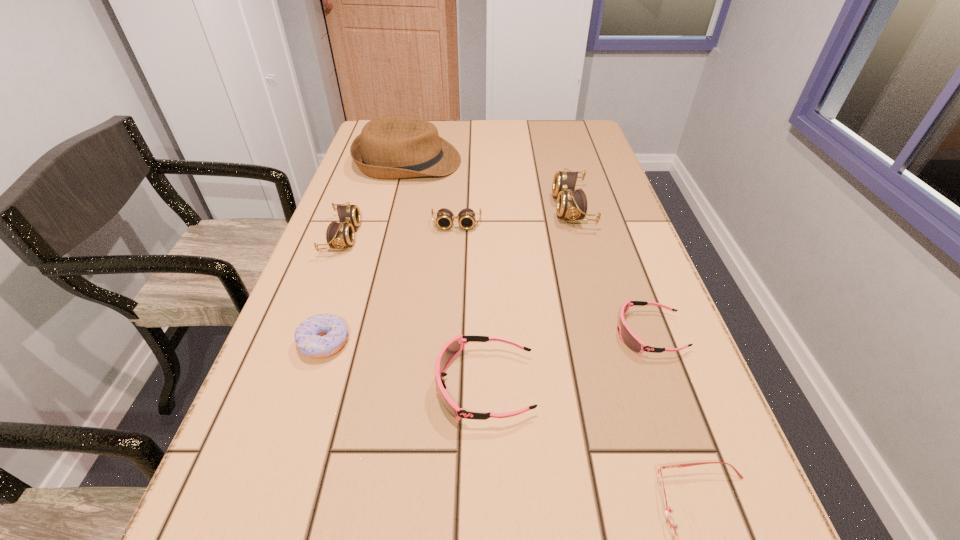
Image resolution: width=960 pixels, height=540 pixels. In order to click on the tallest object in this screenshot , I will do `click(389, 147)`.

Locate an element on the screen. Image resolution: width=960 pixels, height=540 pixels. brown fedora is located at coordinates (389, 147).

Locate an element on the screen. This screenshot has height=540, width=960. the tallest goggles is located at coordinates (571, 203).

Find the location of a particular element. The image size is (960, 540). the seventh shortest object is located at coordinates (571, 203).

You are a GUI agent. You are given a task and a screenshot of the screen. Output one action in this format:
    pyautogui.click(x=<x>, y=<y>)
    Task: Click on the leftmost brown goggles
    The height and width of the screenshot is (540, 960).
    Given the screenshot: What is the action you would take?
    pyautogui.click(x=338, y=235)

Find the location of a particular element. the second smallest brown goggles is located at coordinates (338, 235).

The height and width of the screenshot is (540, 960). What are the coordinates of `the left pink goggles` in the screenshot? It's located at (452, 348).

Locate an element on the screen. The width and height of the screenshot is (960, 540). the smallest brown goggles is located at coordinates (466, 218).

In order to click on brown doughnut in this screenshot , I will do `click(323, 335)`.

I want to click on the right pink goggles, so click(628, 337).